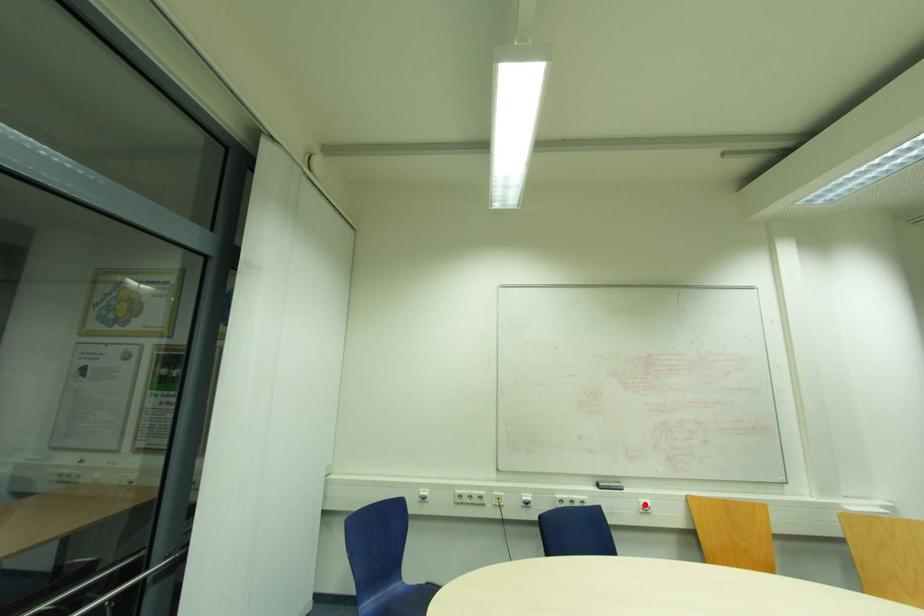
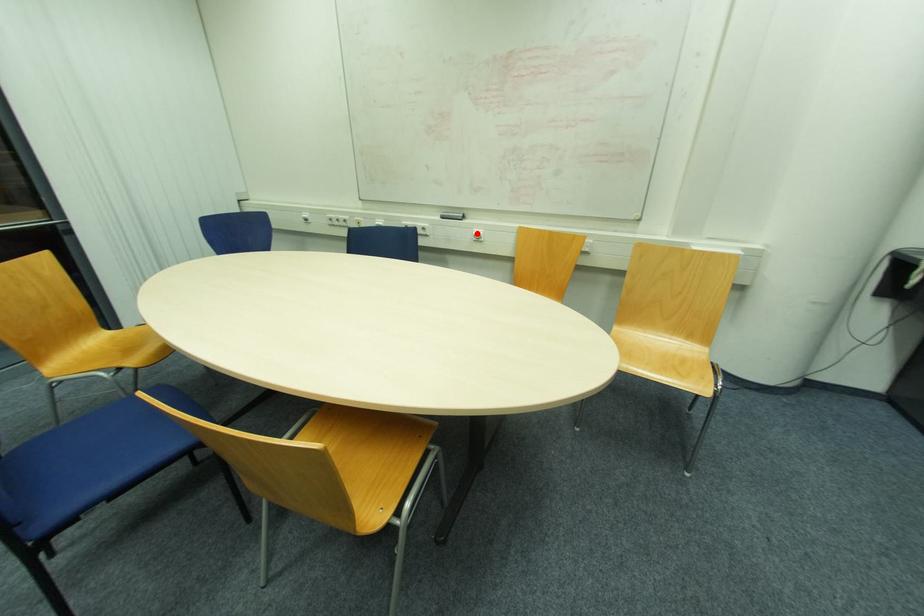
I am providing you with two images of the same scene from different viewpoints. A red point is marked on the first image and another point is marked on the second image. Is the marked point in image1 the same physical position as the marked point in image2?

Yes